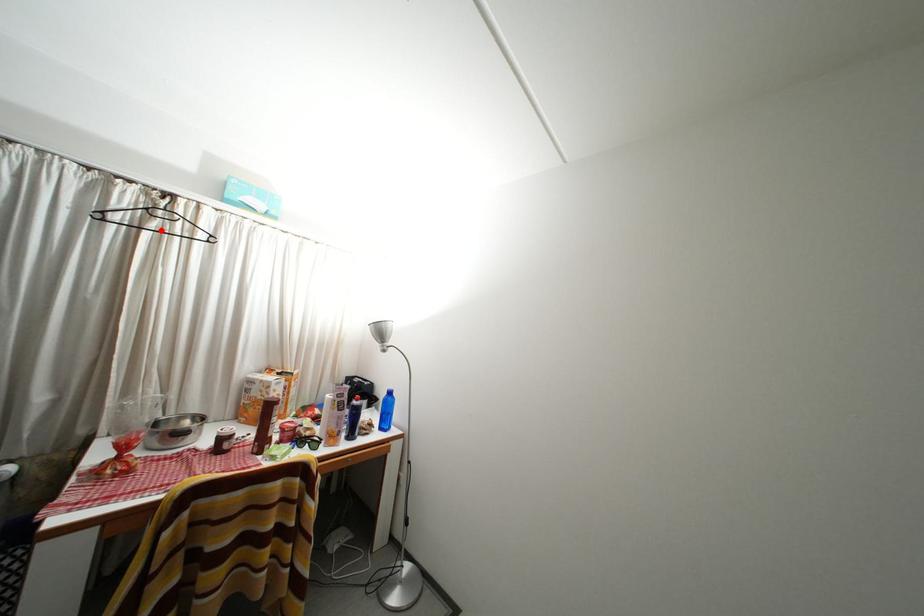
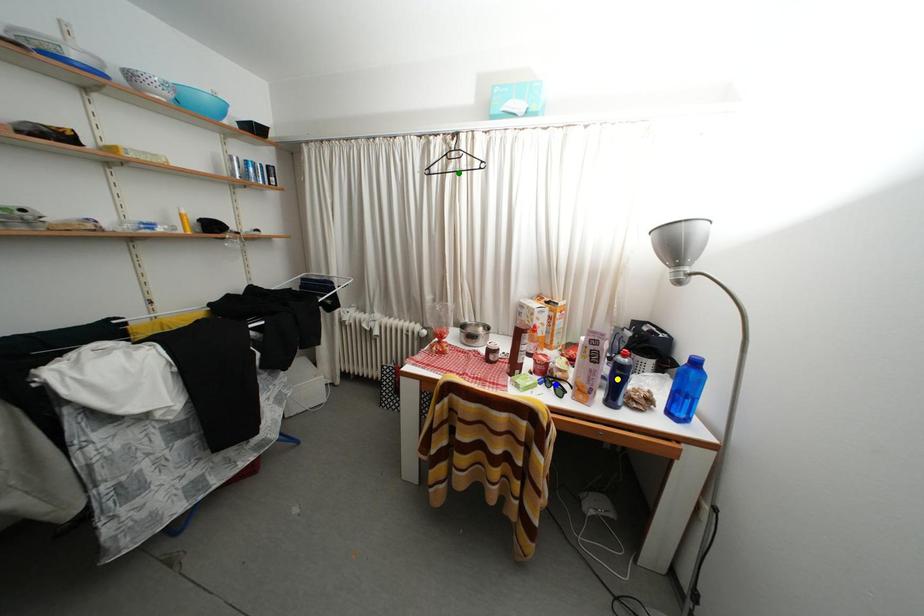
Question: I am providing you with two images of the same scene from different viewpoints. A red point is marked on the first image. You are given multiple points on the second image. Which point in image 2 is actually the same real-world point as the red point in image 1?

Choices:
 (A) green point
 (B) yellow point
 (C) blue point

Answer: (A)